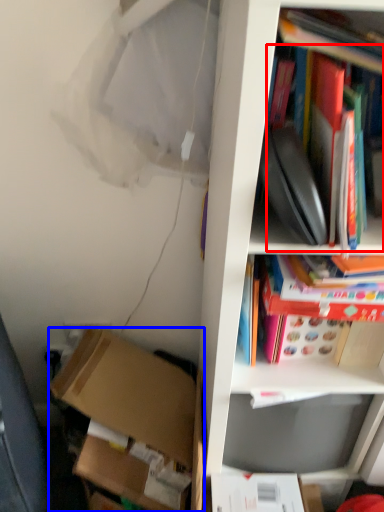
Question: Which of the following is the closest to the observer, book (highlighted by a red box) or box (highlighted by a blue box)?

Choices:
 (A) book
 (B) box

Answer: (A)